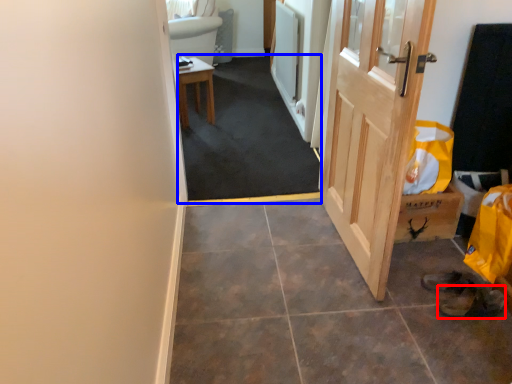
Question: Which of the following is the farthest to the observer, shoe (highlighted by a red box) or corridor (highlighted by a blue box)?

Choices:
 (A) shoe
 (B) corridor

Answer: (B)